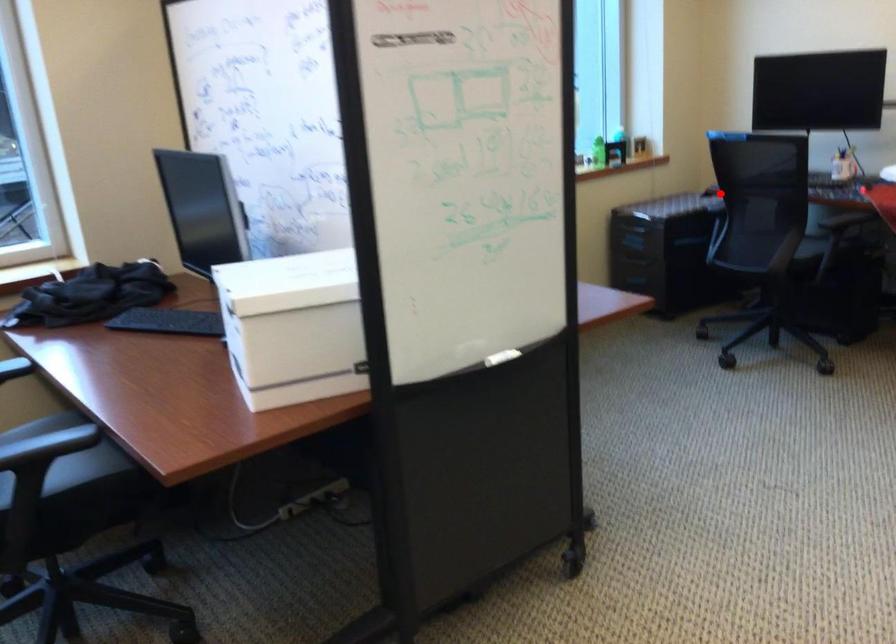
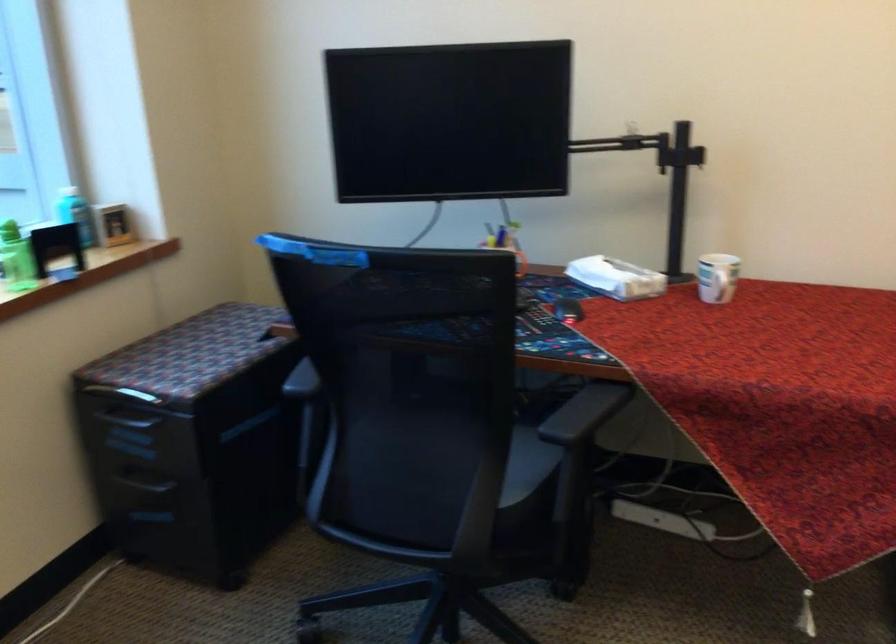
Question: I am providing you with two images of the same scene from different viewpoints. Given a red point in image1, look at the same physical point in image2. Is it:

Choices:
 (A) Closer to the viewpoint
 (B) Farther from the viewpoint

Answer: (A)